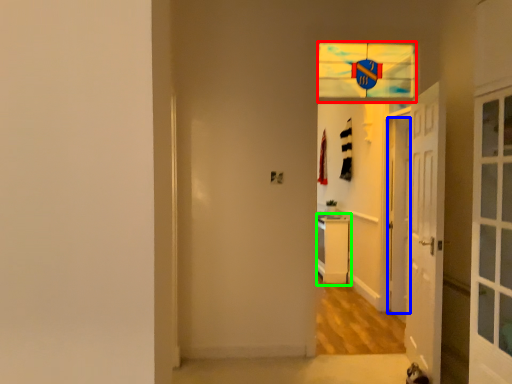
Question: Estimate the real-world distances between objects in this image. Which object is closer to glass window (highlighted by a red box), door (highlighted by a blue box) or dresser (highlighted by a green box)?

Choices:
 (A) door
 (B) dresser

Answer: (A)